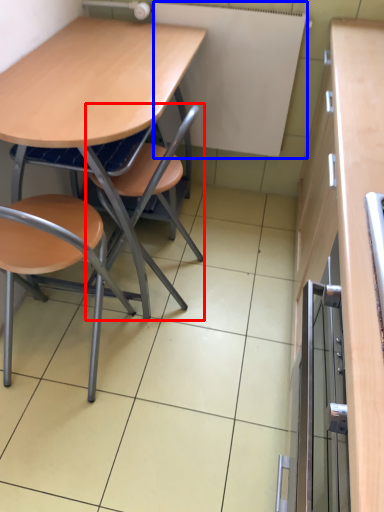
Question: Which object is closer to the camera taking this photo, chair (highlighted by a red box) or bulletin board (highlighted by a blue box)?

Choices:
 (A) chair
 (B) bulletin board

Answer: (A)